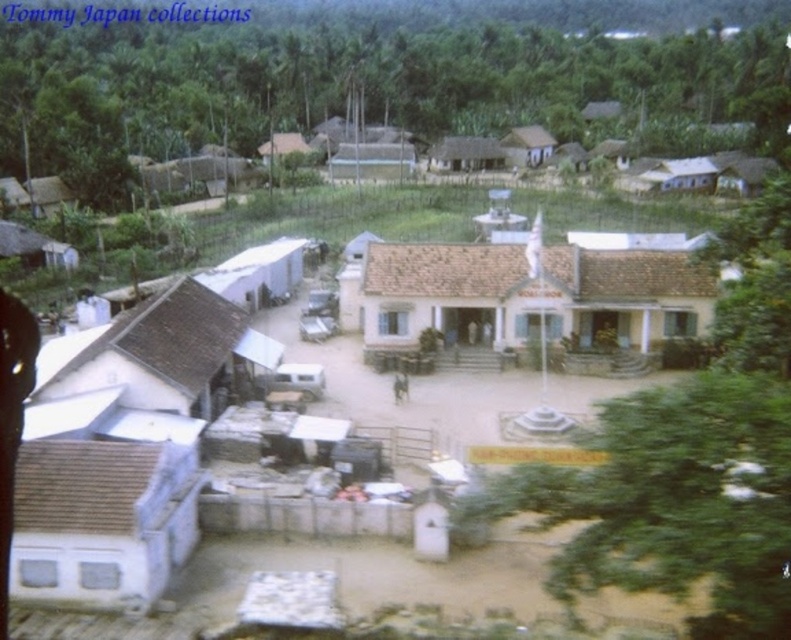
Can you confirm if white matte building at center is positioned above white matte hut at lower left?

Yes.

You are a GUI agent. You are given a task and a screenshot of the screen. Output one action in this format:
    pyautogui.click(x=<x>, y=<y>)
    Task: Click on the white matte building at center
    
    Given the screenshot: What is the action you would take?
    pyautogui.click(x=536, y=301)

Image resolution: width=791 pixels, height=640 pixels. Find the location of `white matte building at center`. white matte building at center is located at coordinates point(536,301).